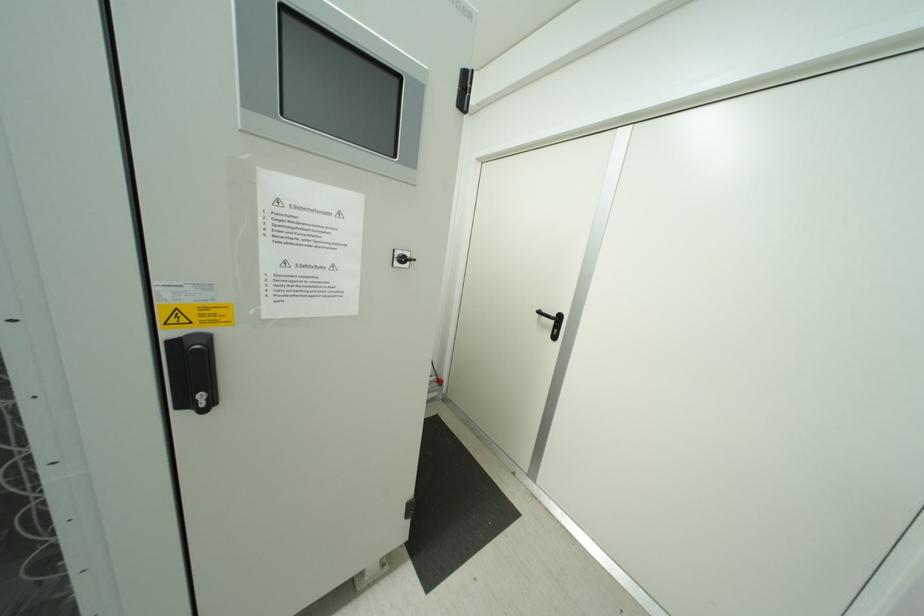
Where would you pull the black cabinet handle? Please return your answer as a coordinate pair (x, y).

(553, 323)